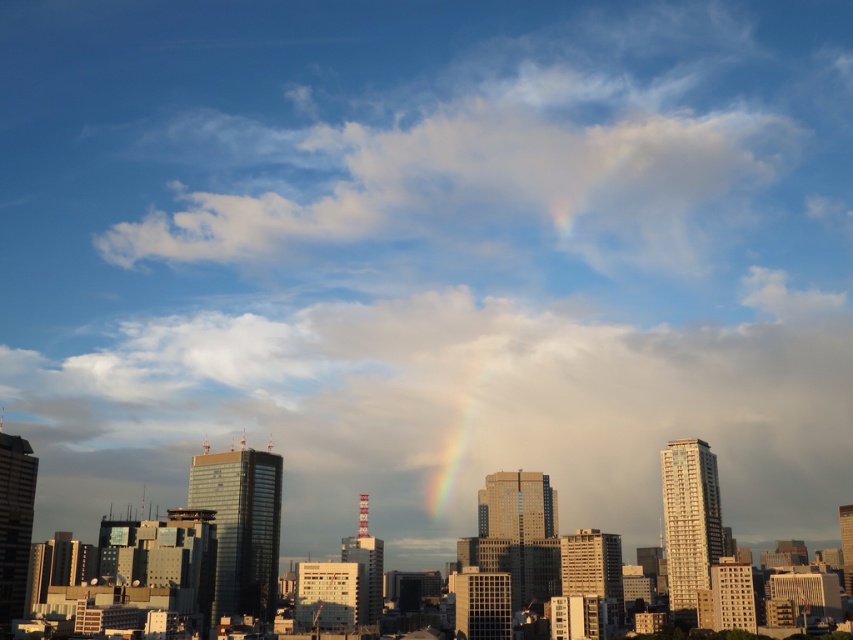
Question: Which object is positioned closest to the white fluffy cloud at upper center?

Choices:
 (A) cloudy sky at center
 (B) rainbow at center

Answer: (A)

Question: Among these objects, which one is nearest to the camera?

Choices:
 (A) white fluffy cloud at upper center
 (B) rainbow at center
 (C) cloudy sky at center

Answer: (C)

Question: Which point is farther from the camera taking this photo?

Choices:
 (A) (300, 410)
 (B) (450, 497)
 (C) (646, 221)

Answer: (C)

Question: Observing the image, what is the correct spatial positioning of cloudy sky at center in reference to white fluffy cloud at upper center?

Choices:
 (A) above
 (B) below

Answer: (B)

Question: Does cloudy sky at center have a greater width compared to rainbow at center?

Choices:
 (A) yes
 (B) no

Answer: (A)

Question: Can you confirm if white fluffy cloud at upper center is wider than rainbow at center?

Choices:
 (A) no
 (B) yes

Answer: (B)